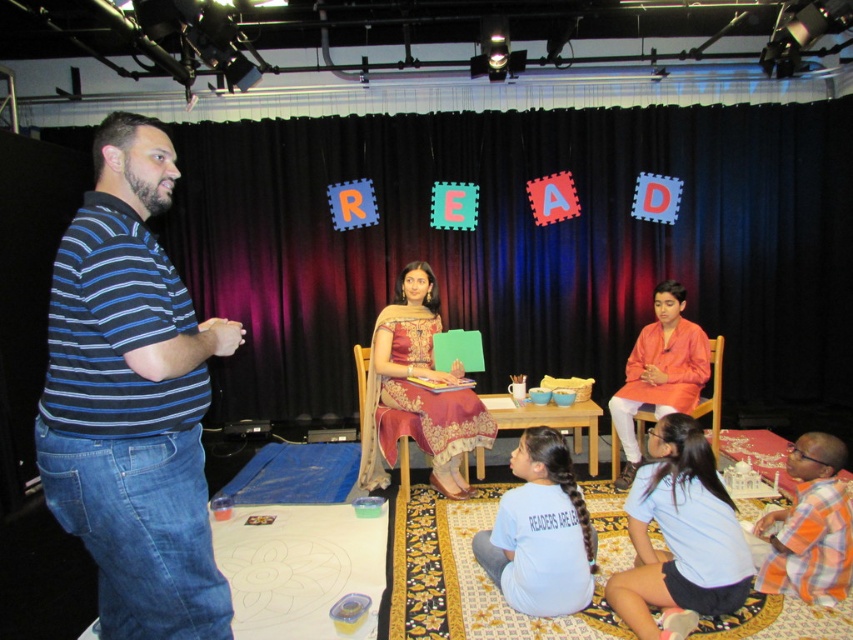
Question: Which object appears farthest from the camera in this image?

Choices:
 (A) blue striped polo shirt at left
 (B) light blue cotton shirt at lower center

Answer: (B)

Question: Which is farther from the light blue cotton shirt at lower center?

Choices:
 (A) embroidered silk sari at center
 (B) light blue fabric at lower center
 (C) blue striped polo shirt at left

Answer: (C)

Question: Which point appears farthest from the camera in this image?

Choices:
 (A) (454, 426)
 (B) (750, 556)
 (C) (138, 388)

Answer: (A)

Question: Is embroidered silk sari at center above light blue cotton shirt at lower center?

Choices:
 (A) yes
 (B) no

Answer: (A)

Question: Does embroidered silk sari at center lie behind orange fabric chair at right?

Choices:
 (A) no
 (B) yes

Answer: (A)

Question: Does blue striped polo shirt at left have a larger size compared to embroidered silk sari at center?

Choices:
 (A) no
 (B) yes

Answer: (A)